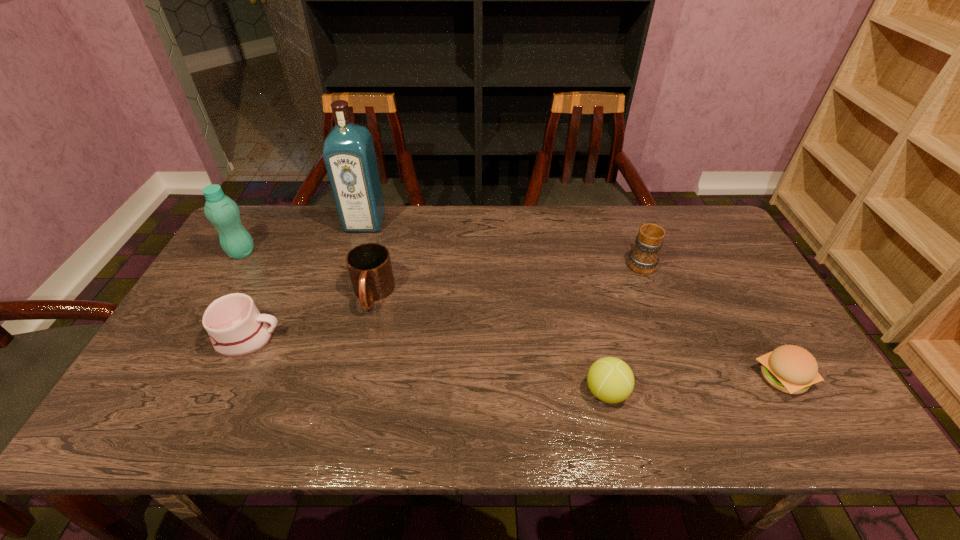
Where is `free space at the far left corner`? The height and width of the screenshot is (540, 960). free space at the far left corner is located at coordinates (274, 213).

Locate an element on the screen. This screenshot has width=960, height=540. vacant space in between the bottle and the second mug from left to right is located at coordinates (307, 274).

The image size is (960, 540). What are the coordinates of `empty space that is in between the sixth object from right to left and the hamburger` in the screenshot? It's located at (516, 357).

Locate an element on the screen. Image resolution: width=960 pixels, height=540 pixels. free space between the leftmost object and the fifth object from left to right is located at coordinates (424, 322).

Where is `unoccupied area between the tallest object and the bottle`? The width and height of the screenshot is (960, 540). unoccupied area between the tallest object and the bottle is located at coordinates (x=303, y=238).

Where is `vacant area that lies between the rightmost object and the third object from right to left`? vacant area that lies between the rightmost object and the third object from right to left is located at coordinates (694, 385).

This screenshot has width=960, height=540. I want to click on free space between the rightmost mug and the bottle, so click(441, 257).

The width and height of the screenshot is (960, 540). Find the location of `free space between the farthest object and the rightmost mug`. free space between the farthest object and the rightmost mug is located at coordinates (502, 242).

Locate an element on the screen. The height and width of the screenshot is (540, 960). empty space that is in between the liquor and the hamburger is located at coordinates (574, 300).

You are a GUI agent. You are given a task and a screenshot of the screen. Output one action in this format:
    pyautogui.click(x=<x>, y=<y>)
    Task: Click on the object that is the fifth closest to the nearest mug
    
    Given the screenshot: What is the action you would take?
    pyautogui.click(x=643, y=258)